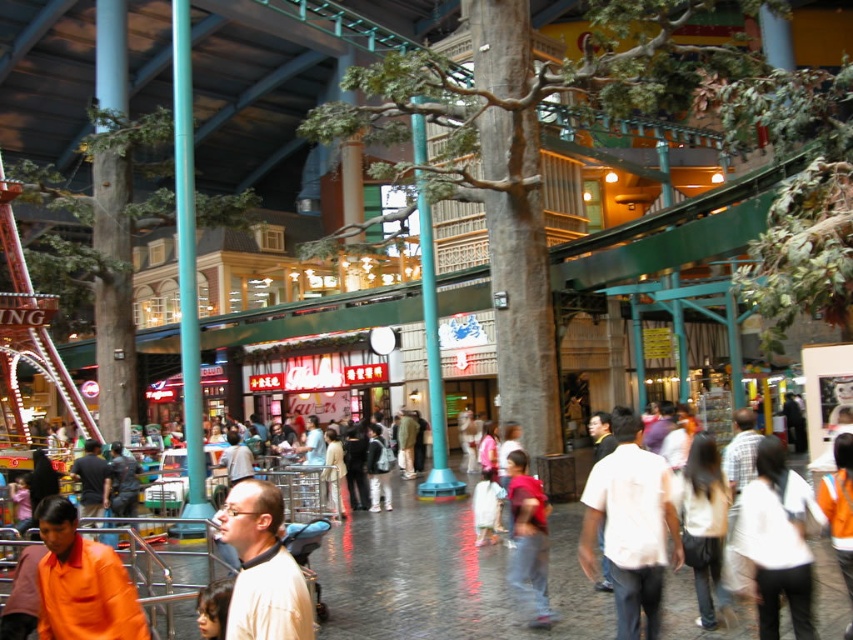
You are a photographer trying to capture a photo of the orange shirt at lower left and the red cotton shirt at center. Which shirt should you focus on first if you want to ensure both are in the frame without moving the camera? Explain your reasoning based on their positions.

The orange shirt at lower left is not as tall as the red cotton shirt at center, so you should focus on the orange shirt at lower left first. Since it is shorter, adjusting the camera angle to include it might also naturally include the taller red cotton shirt at center in the frame.

You are standing in the shopping area and notice an orange shirt at lower left. Where exactly is the orange shirt located in terms of coordinates?

The orange shirt at lower left is located at coordinates point (82, 582).

Based on the photo, you are a photographer trying to capture a candid shot of both the orange shirt at lower left and the light beige shirt at center in the same frame. Given their sizes in the image, which person should you focus on first to ensure both are in the frame?

The orange shirt at lower left occupies less space than the light beige shirt at center, so you should focus on the light beige shirt at center first to ensure both are captured in the frame.